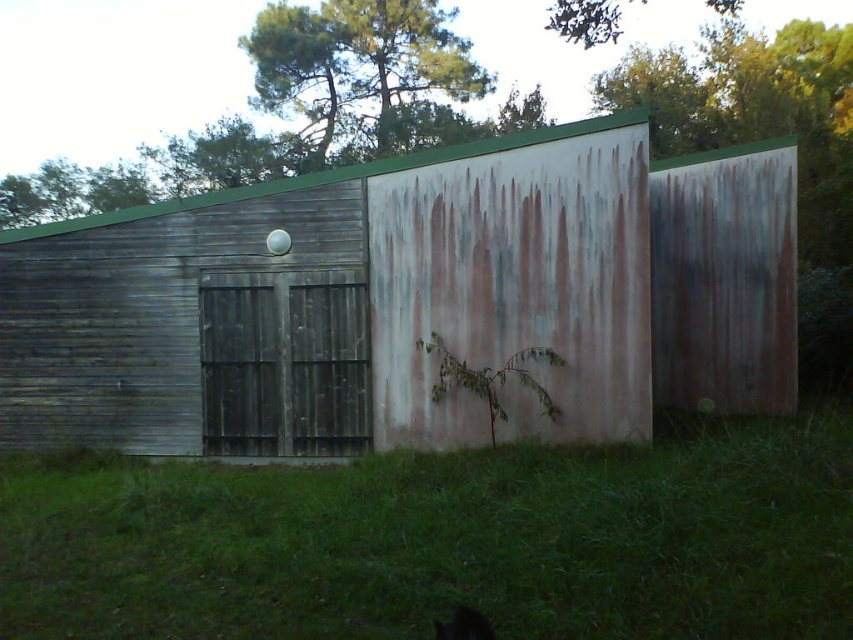
You are standing in front of the building and notice a specific point marked at coordinates (445, 541). Based on the scene description, what object or feature is located at that point?

The point at (445, 541) corresponds to green grass at lower center.

You are standing in front of the building and want to take a photo of the rusty metal barn at center and the green leafy tree at upper center. Which object should you point your camera at first to include both in the frame?

You should point your camera at the rusty metal barn at center first because it is below the green leafy tree at upper center, so adjusting the frame to include both would require starting from the lower position of the barn and expanding upwards to capture the tree above.